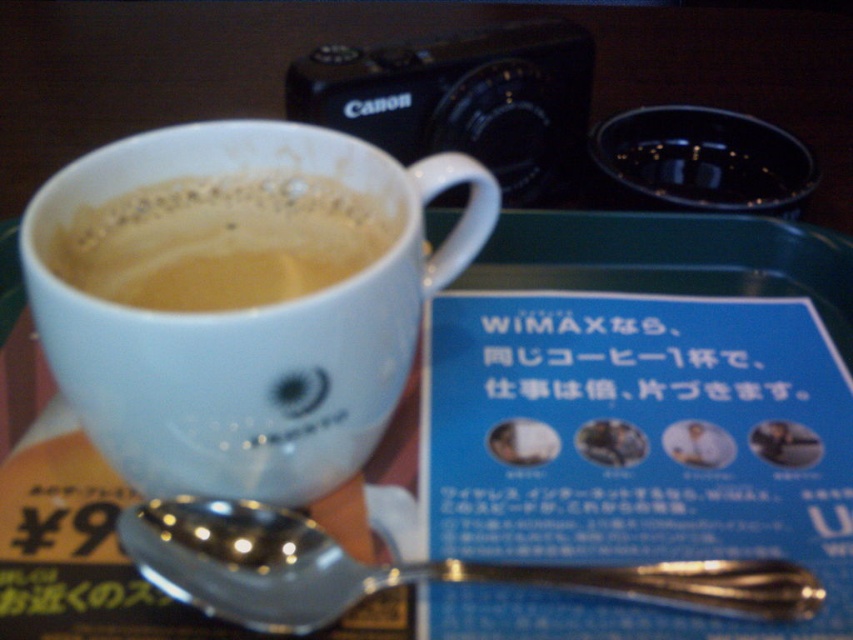
Can you confirm if white glossy mug at upper center is positioned above white matte cup at upper center?

Actually, white glossy mug at upper center is below white matte cup at upper center.

Is the position of white glossy mug at upper center more distant than that of white matte cup at upper center?

No.

Which is behind, point (100, 168) or point (282, 189)?

The point (282, 189) is behind.

Where is `white glossy mug at upper center`? This screenshot has width=853, height=640. white glossy mug at upper center is located at coordinates (247, 323).

Can you confirm if white glossy mug at upper center is wider than silver metallic spoon at lower left?

In fact, white glossy mug at upper center might be narrower than silver metallic spoon at lower left.

Who is higher up, white glossy mug at upper center or silver metallic spoon at lower left?

white glossy mug at upper center is above.

This screenshot has height=640, width=853. I want to click on white glossy mug at upper center, so click(x=247, y=323).

Which is more to the right, silver metallic spoon at lower left or white matte cup at upper center?

silver metallic spoon at lower left

Measure the distance from silver metallic spoon at lower left to white matte cup at upper center.

silver metallic spoon at lower left and white matte cup at upper center are 4.85 inches apart from each other.

Is point (514, 570) positioned before point (91, 212)?

Yes, it is in front of point (91, 212).

This screenshot has height=640, width=853. I want to click on silver metallic spoon at lower left, so click(403, 570).